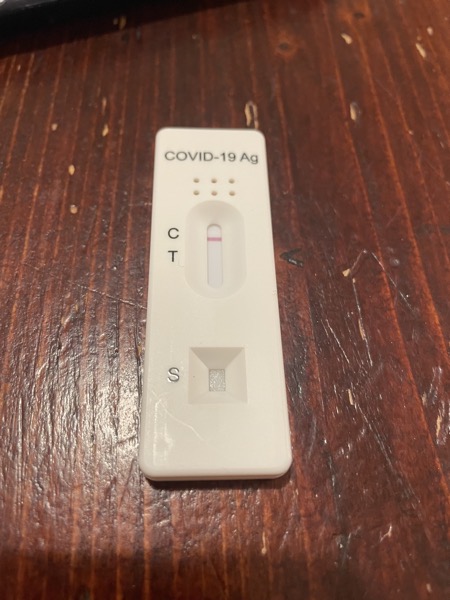
Image resolution: width=450 pixels, height=600 pixels. Identify the location of tan chip marks in table. (75, 209), (106, 128), (72, 168), (353, 108), (418, 47), (249, 111), (344, 37), (439, 422), (349, 396), (344, 275).